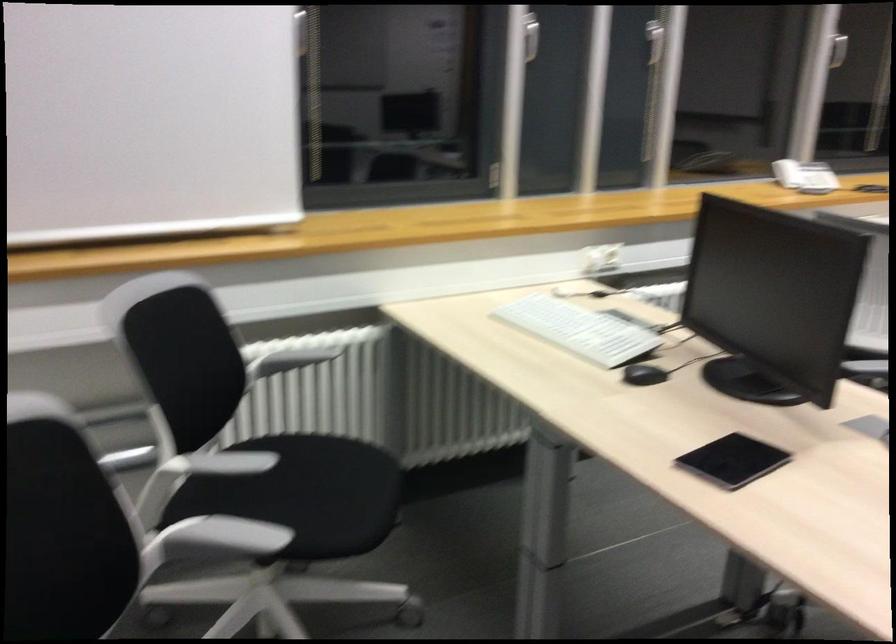
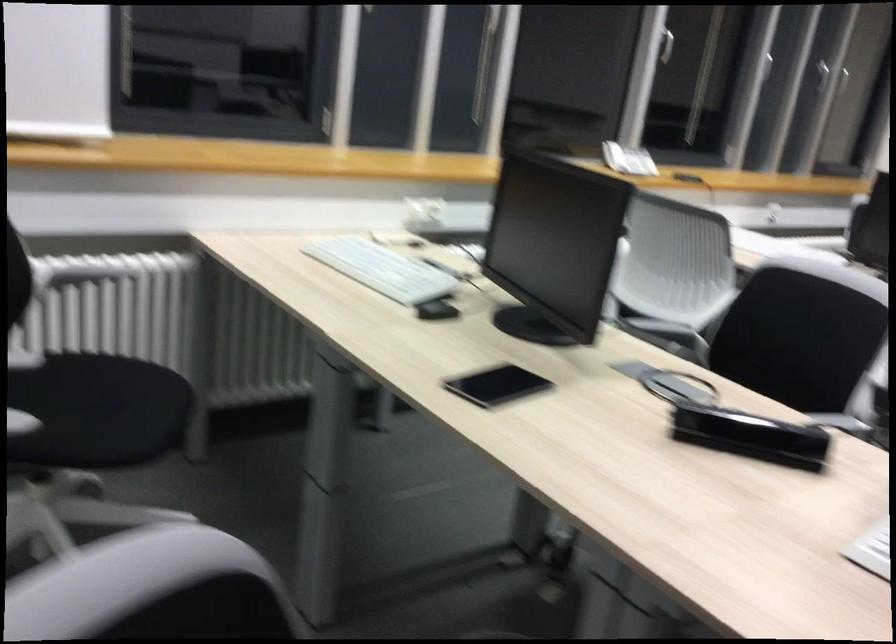
The point at (640,357) is marked in the first image. Where is the corresponding point in the second image?

(435, 297)